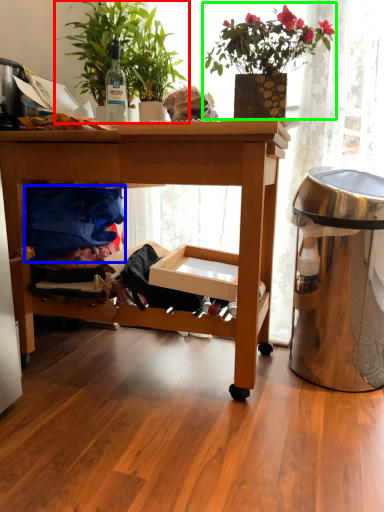
Question: Estimate the real-world distances between objects in this image. Which object is farther from houseplant (highlighted by a red box), clothing (highlighted by a blue box) or houseplant (highlighted by a green box)?

Choices:
 (A) clothing
 (B) houseplant

Answer: (A)